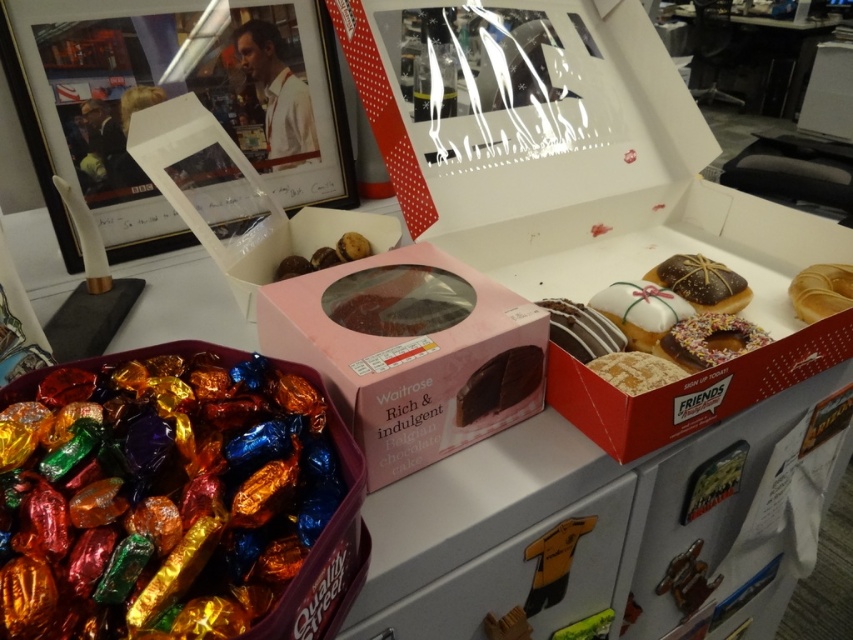
You are a food critic standing at the table and want to taste both the dark chocolate cake at center and the shiny chocolate donut at center. Which one should you reach for first if you want to try the one closer to you?

The dark chocolate cake at center is closer to the viewer than the shiny chocolate donut at center, so you should reach for the dark chocolate cake at center first.

You are a dessert delivery person who needs to place a sprinkled chocolate donut at center and a dark chocolate cake at center into a rectangular box that is 12 inches long. Can both items fit side by side along the length of the box?

The distance between the sprinkled chocolate donut at center and dark chocolate cake at center is 8.74 inches. Since the box is 12 inches long, which is longer than 8.74 inches, both items can fit side by side in the box.

You are a baker who needs to store both the metallic silver drawer at lower center and the white glaze donut at center in a storage container. Which object requires a larger container?

The metallic silver drawer at lower center requires a larger container because it is larger in size than the white glaze donut at center.